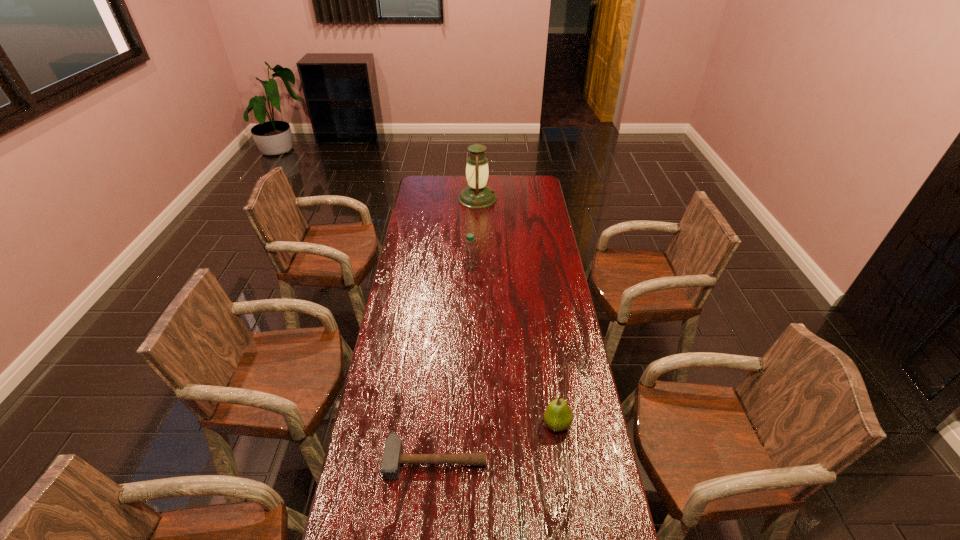
The height and width of the screenshot is (540, 960). In order to click on free space between the farthest object and the rightmost object in this screenshot , I will do `click(517, 311)`.

Locate an element on the screen. unoccupied area between the pear and the second tallest object is located at coordinates (514, 345).

In order to click on unoccupied area between the second shortest object and the tallest object in this screenshot , I will do `click(517, 311)`.

The image size is (960, 540). In order to click on blank region between the third tallest object and the shortest object in this screenshot , I will do `click(496, 442)`.

Image resolution: width=960 pixels, height=540 pixels. What are the coordinates of `blank region between the farthest object and the shortest object` in the screenshot? It's located at (457, 329).

Where is `free spot between the second nearest object and the hammer`? free spot between the second nearest object and the hammer is located at coordinates (496, 442).

Find the location of `vacant area that lies between the third shortest object and the hammer`. vacant area that lies between the third shortest object and the hammer is located at coordinates (453, 363).

I want to click on vacant area that lies between the pear and the tallest object, so click(517, 311).

You are a GUI agent. You are given a task and a screenshot of the screen. Output one action in this format:
    pyautogui.click(x=<x>, y=<y>)
    Task: Click on the vacant space that is in between the hammer and the second shortest object
    
    Given the screenshot: What is the action you would take?
    pyautogui.click(x=496, y=442)

This screenshot has height=540, width=960. Identify the location of the third closest object to the hammer. (477, 195).